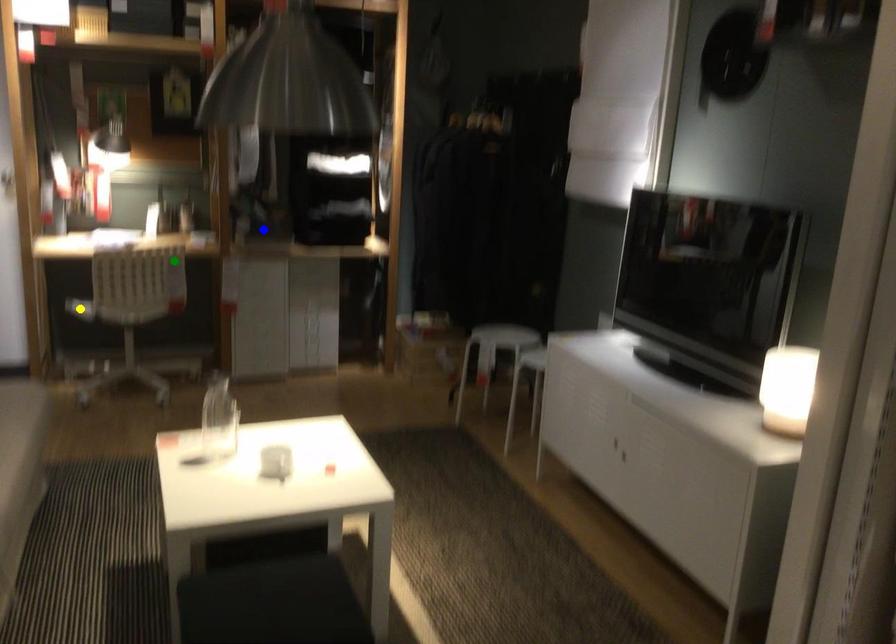
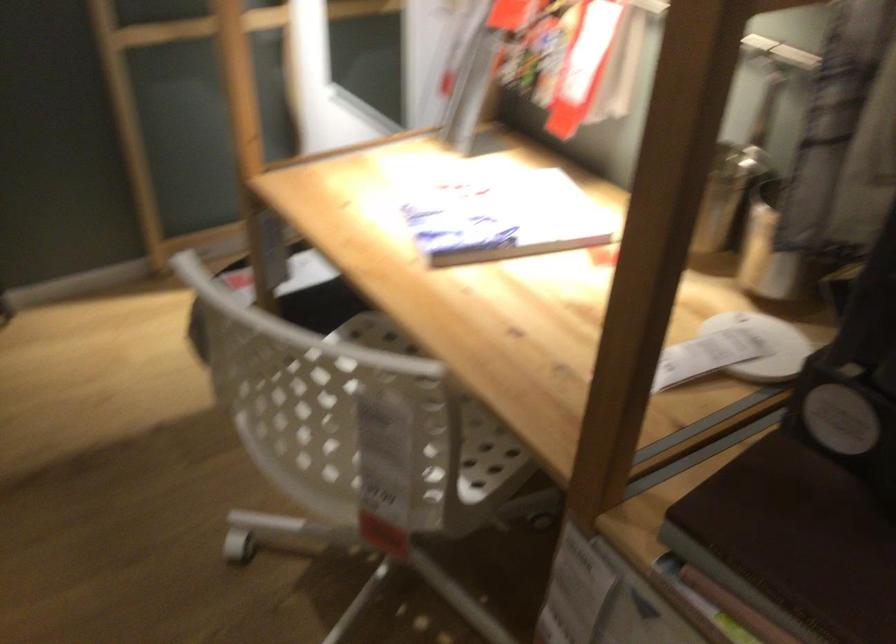
I am providing you with two images of the same scene from different viewpoints. Three points are marked in image1. Which point corresponds to a part or object that is occluded in image2?In image1, three points are marked. Which of them correspond to a part or object that is occluded in image2?Among the three points shown in image1, which one corresponds to a part or object that is no longer visible due to occlusion in image2?

yellow point cannot be seen in image2.